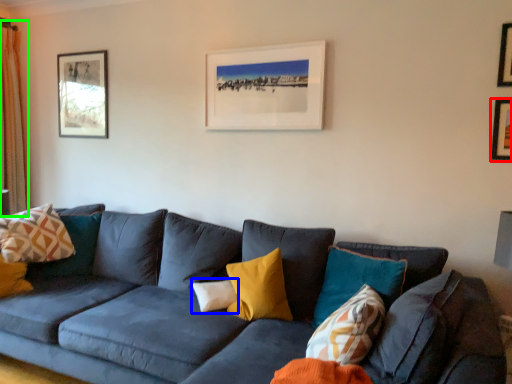
Question: Estimate the real-world distances between objects in this image. Which object is farther from picture frame (highlighted by a red box), pillow (highlighted by a blue box) or curtain (highlighted by a green box)?

Choices:
 (A) pillow
 (B) curtain

Answer: (B)